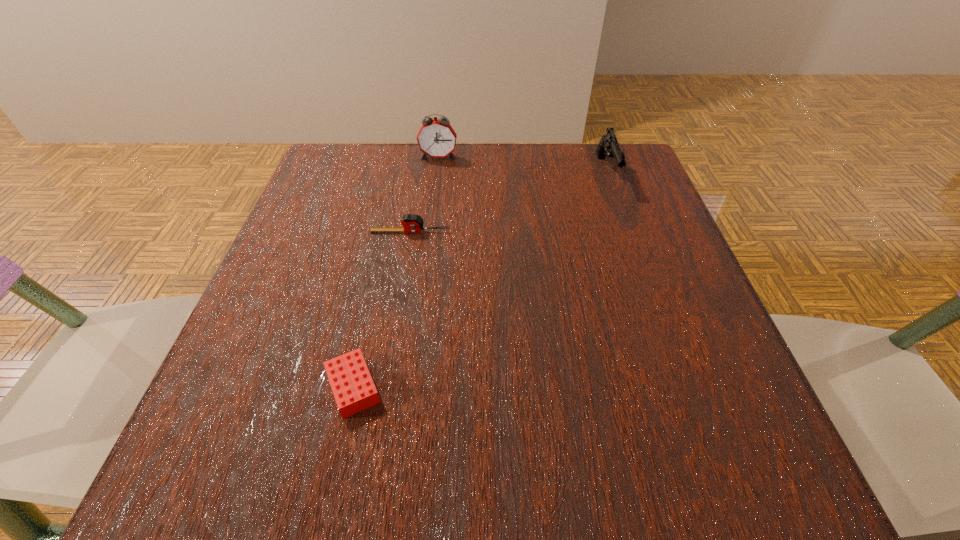
In order to click on the tallest object in this screenshot , I will do `click(436, 138)`.

What are the coordinates of `the second tallest object` in the screenshot? It's located at (608, 146).

Locate an element on the screen. The width and height of the screenshot is (960, 540). the rightmost object is located at coordinates (608, 146).

The image size is (960, 540). What are the coordinates of `the third tallest object` in the screenshot? It's located at (411, 223).

You are a GUI agent. You are given a task and a screenshot of the screen. Output one action in this format:
    pyautogui.click(x=<x>, y=<y>)
    Task: Click on the tape measure
    
    Given the screenshot: What is the action you would take?
    pyautogui.click(x=411, y=223)

Find the location of a particular element. The image size is (960, 540). the nearest object is located at coordinates (352, 385).

Where is `Lego`? Lego is located at coordinates (352, 385).

Identify the location of vacant space located on the clock face of the alarm clock. The width and height of the screenshot is (960, 540). (435, 185).

I want to click on vacant space situated 0.160m at the end of the barrel of the gun, so click(x=632, y=243).

In order to click on vacant region located 0.180m on the front of the tape measure in this screenshot , I will do `click(398, 305)`.